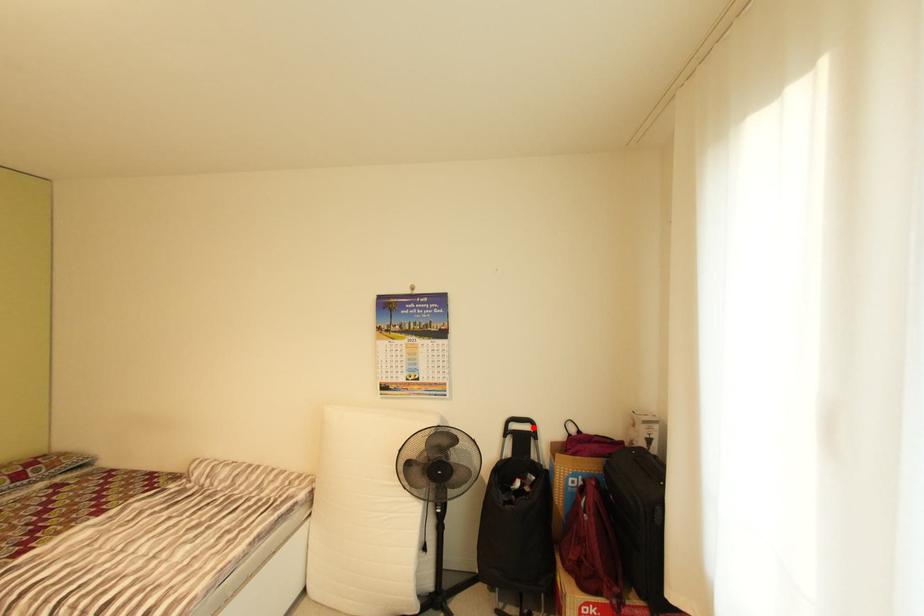
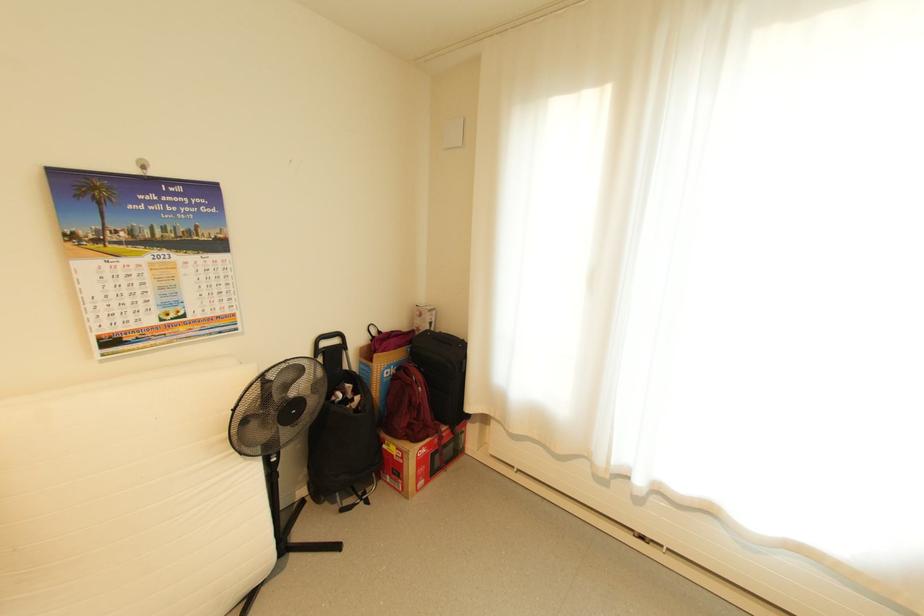
Locate, in the second image, the point that corresponds to the highlighted location in the first image.

(342, 342)